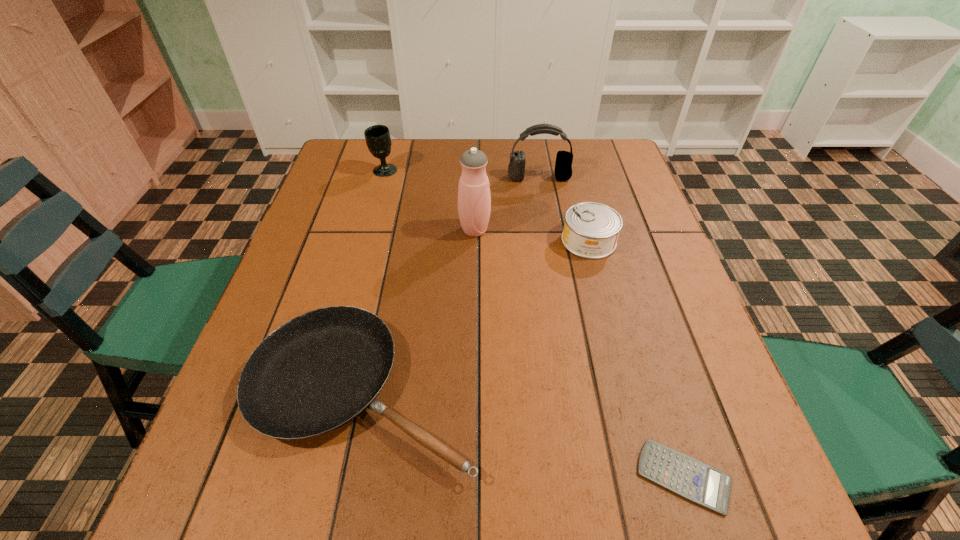
Where is `unoccupied position between the can and the thermos bottle`? Image resolution: width=960 pixels, height=540 pixels. unoccupied position between the can and the thermos bottle is located at coordinates (532, 235).

I want to click on free point between the shortest object and the second tallest object, so click(x=612, y=327).

At what (x,y) coordinates should I click in order to perform the action: click on free point between the calculator and the fifth tallest object. Please return your answer as a coordinate pair (x, y). Looking at the image, I should click on (523, 433).

The height and width of the screenshot is (540, 960). Find the location of `free space between the tallest object and the can`. free space between the tallest object and the can is located at coordinates (532, 235).

Find the location of a particular element. The height and width of the screenshot is (540, 960). empty location between the fourth tallest object and the thermos bottle is located at coordinates (532, 235).

You are a GUI agent. You are given a task and a screenshot of the screen. Output one action in this format:
    pyautogui.click(x=<x>, y=<y>)
    Task: Click on the free space between the headset and the shortest object
    Image resolution: width=960 pixels, height=540 pixels.
    Given the screenshot: What is the action you would take?
    pyautogui.click(x=612, y=327)

Where is `vacant space that is in between the second shortest object and the tallest object`? vacant space that is in between the second shortest object and the tallest object is located at coordinates click(x=419, y=310).

Image resolution: width=960 pixels, height=540 pixels. What are the coordinates of `the third closest object relative to the can` in the screenshot? It's located at (317, 372).

Identify which object is the fourth closest to the can. Please provide its 2D coordinates. Your answer should be formatted as a tuple, i.e. [(x, y)], where the tuple contains the x and y coordinates of a point satisfying the conditions above.

[(692, 479)]

Locate an element on the screen. The image size is (960, 540). free space in the image that satisfies the following two spatial constraints: 1. on the headband of the headset; 2. on the left side of the can is located at coordinates (549, 241).